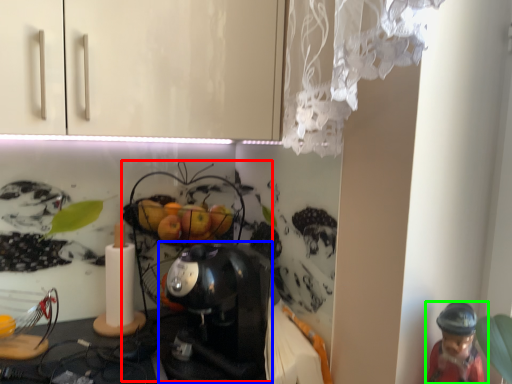
Question: Based on their relative distances, which object is farther from toy (highlighted by a red box)? Choose from coffee maker (highlighted by a blue box) and person (highlighted by a green box).

Choices:
 (A) coffee maker
 (B) person

Answer: (B)